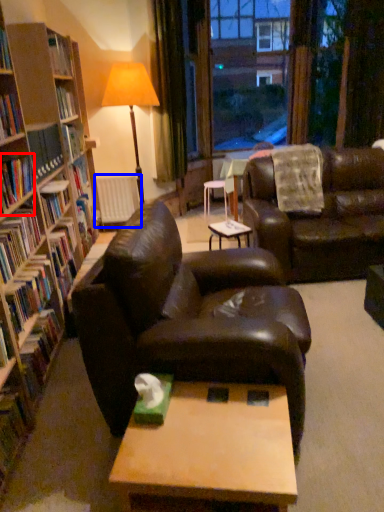
Question: Which of the following is the farthest to the observer, book (highlighted by a red box) or radiator (highlighted by a blue box)?

Choices:
 (A) book
 (B) radiator

Answer: (B)